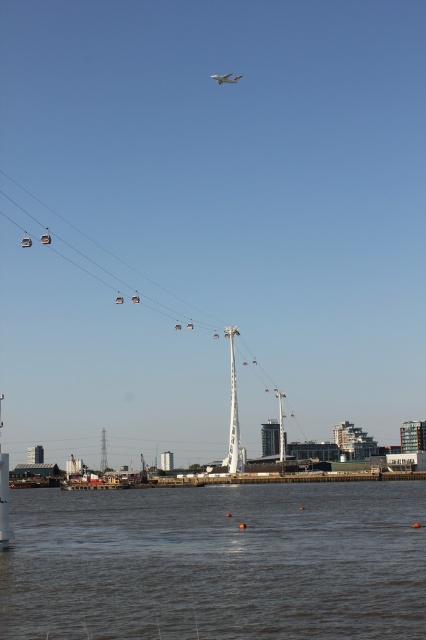
Question: Is brown water at lower center thinner than white matte airplane at upper center?

Choices:
 (A) yes
 (B) no

Answer: (B)

Question: Is brown water at lower center above white matte airplane at upper center?

Choices:
 (A) yes
 (B) no

Answer: (B)

Question: Is brown water at lower center above white matte airplane at upper center?

Choices:
 (A) no
 (B) yes

Answer: (A)

Question: Which of the following is the closest to the observer?

Choices:
 (A) metallic cable car at center
 (B) white matte airplane at upper center
 (C) brown water at lower center

Answer: (C)

Question: Estimate the real-world distances between objects in this image. Which object is closer to the metallic cable car at center?

Choices:
 (A) brown water at lower center
 (B) white matte airplane at upper center

Answer: (B)

Question: Which point is closer to the camera?

Choices:
 (A) (279, 221)
 (B) (235, 77)

Answer: (B)